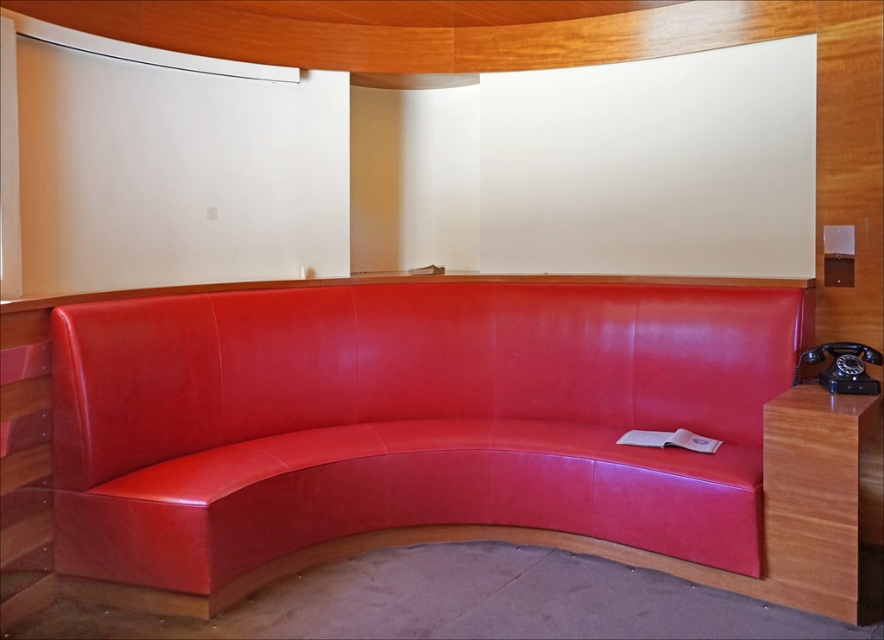
Question: Is matte leather couch at center below black rubberized phone at right?

Choices:
 (A) no
 (B) yes

Answer: (B)

Question: Which of the following is the farthest from the observer?

Choices:
 (A) (761, 337)
 (B) (865, 372)

Answer: (A)

Question: Is matte leather couch at center above black rubberized phone at right?

Choices:
 (A) no
 (B) yes

Answer: (A)

Question: Is matte leather couch at center positioned behind black rubberized phone at right?

Choices:
 (A) yes
 (B) no

Answer: (B)